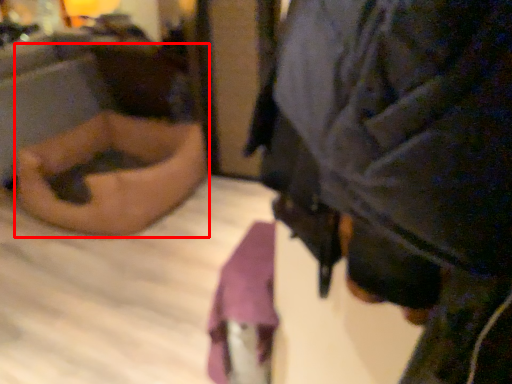
Question: From the image's perspective, where is person (annotated by the red box) located relative to person?

Choices:
 (A) below
 (B) above

Answer: (B)